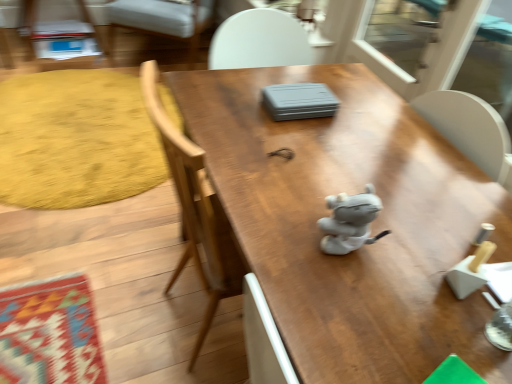
Question: From a real-world perspective, is transparent plastic screen door at upper right located higher than yellow textured rug at left?

Choices:
 (A) no
 (B) yes

Answer: (B)

Question: Would you say transparent plastic screen door at upper right contains yellow textured rug at left?

Choices:
 (A) yes
 (B) no

Answer: (B)

Question: Is transparent plastic screen door at upper right at the right side of yellow textured rug at left?

Choices:
 (A) no
 (B) yes

Answer: (B)

Question: Is transparent plastic screen door at upper right in contact with yellow textured rug at left?

Choices:
 (A) no
 (B) yes

Answer: (A)

Question: Does transparent plastic screen door at upper right have a greater height compared to yellow textured rug at left?

Choices:
 (A) no
 (B) yes

Answer: (B)

Question: Visually, is transparent plastic screen door at upper right positioned to the left or to the right of white fabric chair at upper left?

Choices:
 (A) right
 (B) left

Answer: (A)

Question: Is transparent plastic screen door at upper right spatially inside white fabric chair at upper left, or outside of it?

Choices:
 (A) inside
 (B) outside

Answer: (B)

Question: Based on their sizes in the image, would you say transparent plastic screen door at upper right is bigger or smaller than white fabric chair at upper left?

Choices:
 (A) small
 (B) big

Answer: (A)

Question: From a real-world perspective, is transparent plastic screen door at upper right physically located above or below white fabric chair at upper left?

Choices:
 (A) below
 (B) above

Answer: (B)

Question: Considering the positions of wooden table at center and transparent plastic screen door at upper right in the image, is wooden table at center wider or thinner than transparent plastic screen door at upper right?

Choices:
 (A) thin
 (B) wide

Answer: (B)

Question: From a real-world perspective, is wooden table at center physically located above or below transparent plastic screen door at upper right?

Choices:
 (A) above
 (B) below

Answer: (B)

Question: Considering their positions, is wooden table at center located in front of or behind transparent plastic screen door at upper right?

Choices:
 (A) behind
 (B) front

Answer: (B)

Question: Which is correct: wooden table at center is inside transparent plastic screen door at upper right, or outside of it?

Choices:
 (A) outside
 (B) inside

Answer: (A)

Question: Does point (137, 188) appear closer or farther from the camera than point (345, 201)?

Choices:
 (A) farther
 (B) closer

Answer: (A)

Question: Choose the correct answer: Is yellow textured rug at left inside gray fabric toy at center or outside it?

Choices:
 (A) outside
 (B) inside

Answer: (A)